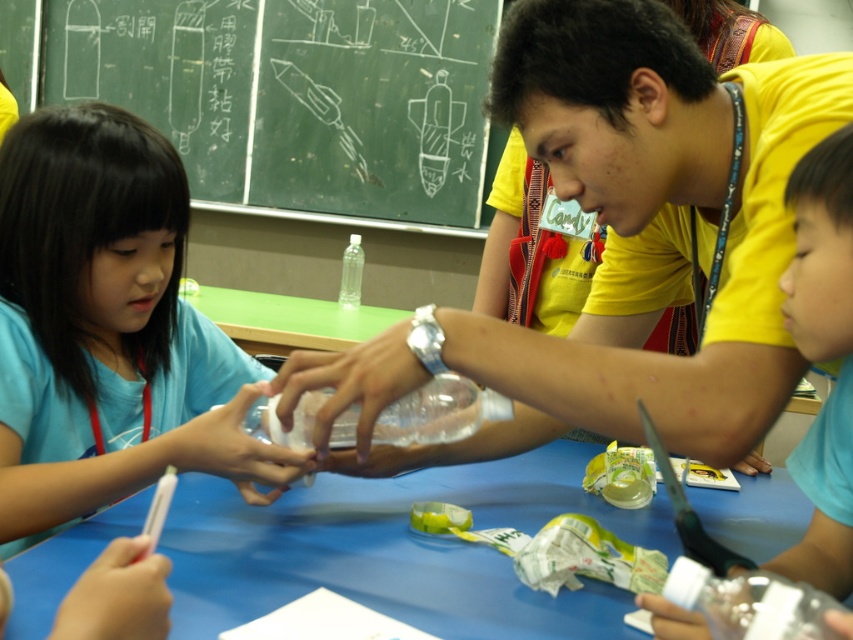
You are a student in the classroom and want to draw on the white chalkboard at upper left. Can you reach it from where you are standing, considering the size of the matte blue shirt at left?

The matte blue shirt at left is smaller than the white chalkboard at upper left, so the chalkboard is larger and likely within reach for drawing.

You are a student in the classroom observing the translucent plastic bottle at right and the transparent plastic bottle at center. Which bottle is located to the right of the other?

The translucent plastic bottle at right is positioned on the right side of transparent plastic bottle at center.

You are a student in this classroom and need to write something on the white chalkboard at upper left. Can you reach it while standing in front of the matte blue shirt at left?

The matte blue shirt at left is positioned under the white chalkboard at upper left, so the student can reach the white chalkboard at upper left by standing in front of the matte blue shirt at left.